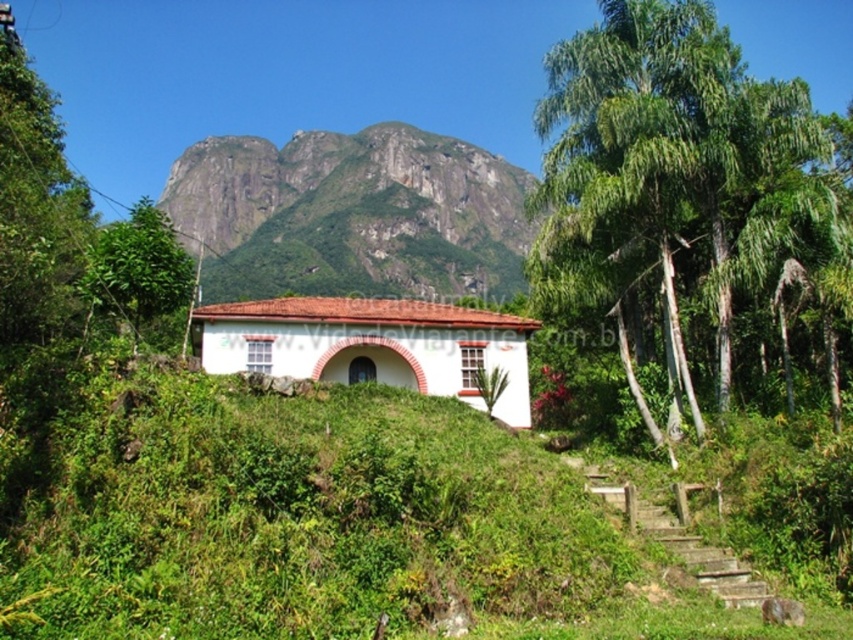
Question: Does green leafy palm at center right appear under rocky cliff at upper center?

Choices:
 (A) yes
 (B) no

Answer: (A)

Question: Is green leafy palm at center right below green leafy tree at left?

Choices:
 (A) yes
 (B) no

Answer: (A)

Question: Is green leafy palm at center right positioned in front of rocky cliff at upper center?

Choices:
 (A) no
 (B) yes

Answer: (B)

Question: Among these objects, which one is nearest to the camera?

Choices:
 (A) green leafy palm at center right
 (B) green leafy tree at left
 (C) rocky cliff at upper center

Answer: (B)

Question: Which point appears closest to the camera in this image?

Choices:
 (A) (566, 70)
 (B) (167, 307)

Answer: (B)

Question: Based on their relative distances, which object is nearer to the green leafy tree at left?

Choices:
 (A) green leafy palm at center right
 (B) rocky cliff at upper center

Answer: (A)